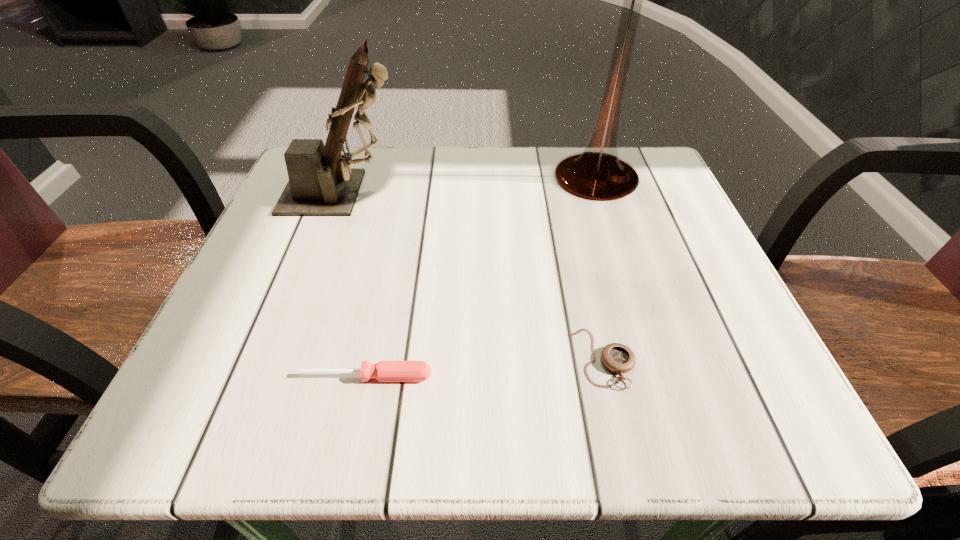
Where is `vacant space at the left edge of the desktop`? This screenshot has height=540, width=960. vacant space at the left edge of the desktop is located at coordinates (220, 367).

Where is `free point at the right edge`? The width and height of the screenshot is (960, 540). free point at the right edge is located at coordinates (636, 227).

Locate an element on the screen. blank area at the far left corner is located at coordinates point(350,149).

Locate an element on the screen. This screenshot has width=960, height=540. vacant space at the far right corner of the desktop is located at coordinates (650, 180).

The image size is (960, 540). I want to click on vacant space that is in between the table lamp and the shortest object, so click(x=599, y=267).

Locate an element on the screen. free spot between the pocket watch and the table lamp is located at coordinates (599, 267).

This screenshot has width=960, height=540. I want to click on free space between the pocket watch and the tallest object, so click(x=599, y=267).

This screenshot has width=960, height=540. I want to click on vacant space in between the shortest object and the screwdriver, so click(485, 367).

Find the location of a particular element. vacant point located between the third tallest object and the shortest object is located at coordinates pyautogui.click(x=485, y=367).

Identify the location of free space between the pocket watch and the tallest object. (599, 267).